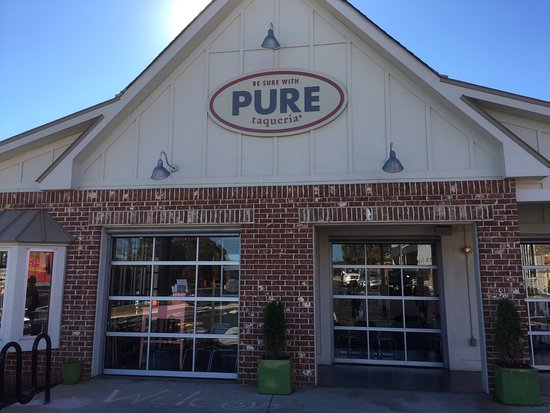
This screenshot has height=413, width=550. I want to click on empty plant pot, so click(74, 368).